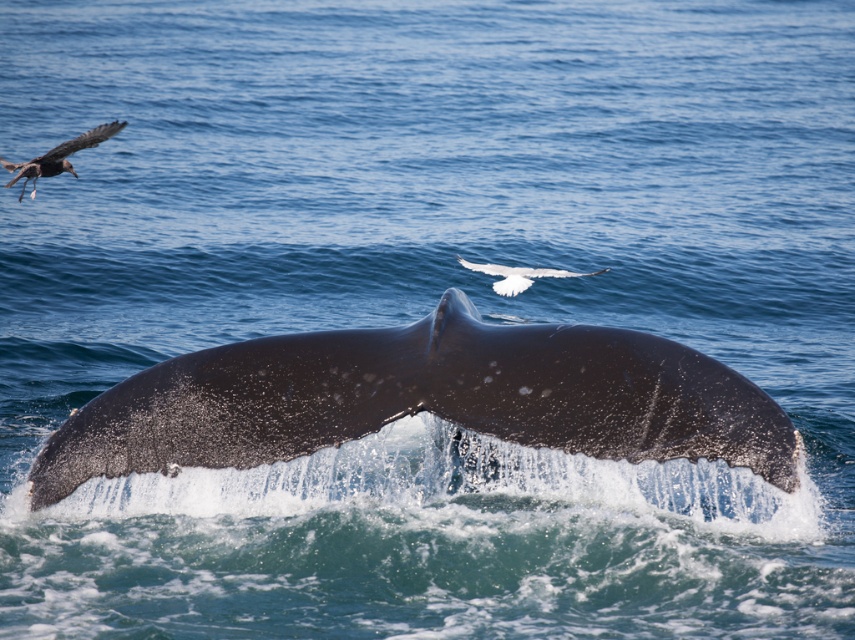
Question: Can you confirm if dark gray textured tail fin at center is bigger than white feathered bird at upper center?

Choices:
 (A) yes
 (B) no

Answer: (A)

Question: Estimate the real-world distances between objects in this image. Which object is closer to the dark gray textured tail fin at center?

Choices:
 (A) white feathered bird at upper center
 (B) shiny black bird at upper left

Answer: (B)

Question: Which point is farther to the camera?

Choices:
 (A) (38, 490)
 (B) (21, 163)
 (C) (596, 269)

Answer: (C)

Question: Which of the following is the farthest from the observer?

Choices:
 (A) dark gray textured tail fin at center
 (B) white feathered bird at upper center

Answer: (B)

Question: Can you confirm if shiny black bird at upper left is bigger than white feathered bird at upper center?

Choices:
 (A) no
 (B) yes

Answer: (B)

Question: Is shiny black bird at upper left thinner than white feathered bird at upper center?

Choices:
 (A) yes
 (B) no

Answer: (B)